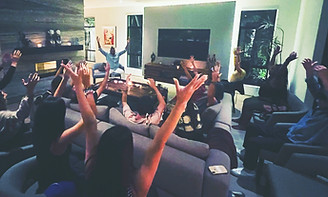
Identify the location of shoe. (243, 174).